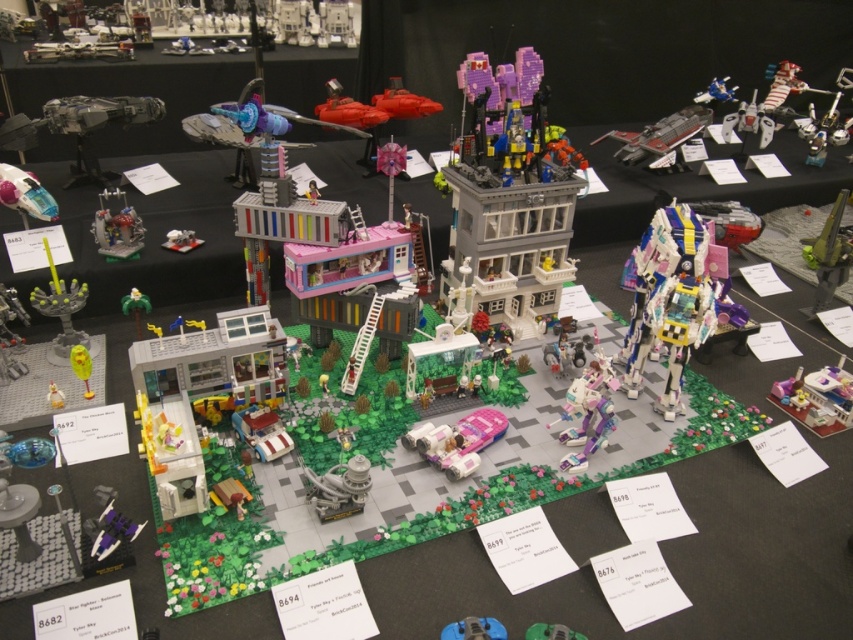
Measure the distance from metallic silver spaceship at upper right to green matte palm tree at lower left.

metallic silver spaceship at upper right and green matte palm tree at lower left are 1.64 meters apart.

Is point (602, 134) positioned before point (148, 308)?

No, (602, 134) is behind (148, 308).

Is point (596, 140) closer to viewer compared to point (129, 310)?

No, (596, 140) is further to viewer.

At what (x,y) coordinates should I click in order to perform the action: click on metallic silver spaceship at upper right. Please return your answer as a coordinate pair (x, y). The height and width of the screenshot is (640, 853). Looking at the image, I should click on (659, 134).

Can you confirm if green plastic toy at lower center is positioned to the left of metallic blue spaceship at upper right?

Correct, you'll find green plastic toy at lower center to the left of metallic blue spaceship at upper right.

Between point (561, 628) and point (723, 77), which one is positioned behind?

Positioned behind is point (723, 77).

In order to click on green plastic toy at lower center in this screenshot , I will do `click(550, 632)`.

Who is taller, translucent white plastic robot at center-right or metallic blue car at lower center?

With more height is translucent white plastic robot at center-right.

Is translucent white plastic robot at center-right wider than metallic blue car at lower center?

Yes, translucent white plastic robot at center-right is wider than metallic blue car at lower center.

Identify the location of translucent white plastic robot at center-right. This screenshot has height=640, width=853. (674, 298).

Where is `translucent white plastic robot at center-right`? Image resolution: width=853 pixels, height=640 pixels. translucent white plastic robot at center-right is located at coordinates (674, 298).